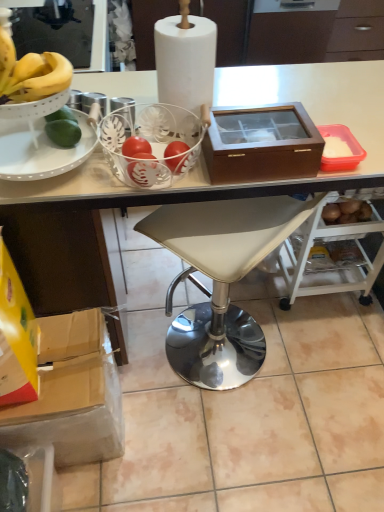
This screenshot has width=384, height=512. Identify the location of empty space that is to the right of white leather stool at center. (317, 365).